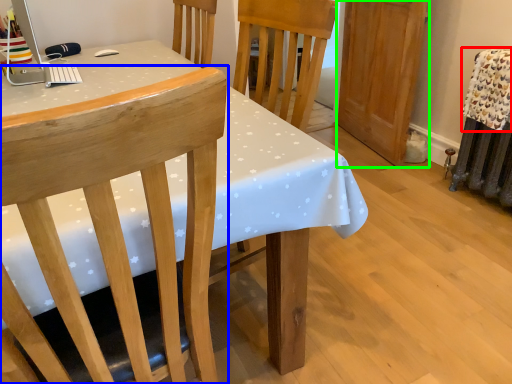
Question: Which is nearer to the blanket (highlighted by a red box)? chair (highlighted by a blue box) or armoire (highlighted by a green box).

Choices:
 (A) chair
 (B) armoire

Answer: (B)